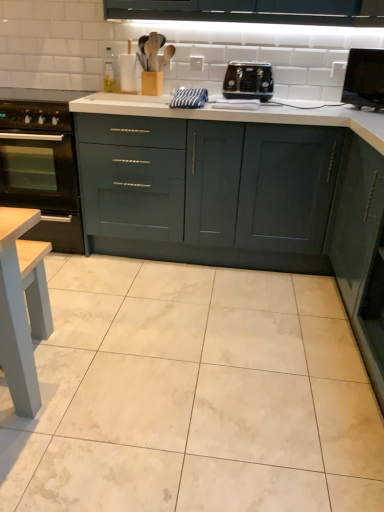
Question: Should I look upward or downward to see teal matte cabinet at center, the 1th cabinetry positioned from the left?

Choices:
 (A) down
 (B) up

Answer: (B)

Question: Considering the relative sizes of white glossy tile at center and black glass oven at lower left in the image provided, is white glossy tile at center shorter than black glass oven at lower left?

Choices:
 (A) yes
 (B) no

Answer: (A)

Question: Does white glossy tile at center have a smaller size compared to black glass oven at lower left?

Choices:
 (A) no
 (B) yes

Answer: (B)

Question: Considering the relative positions of white glossy tile at center and black glass oven at lower left in the image provided, is white glossy tile at center behind black glass oven at lower left?

Choices:
 (A) yes
 (B) no

Answer: (B)

Question: Considering the relative sizes of white glossy tile at center and black glass oven at lower left in the image provided, is white glossy tile at center thinner than black glass oven at lower left?

Choices:
 (A) no
 (B) yes

Answer: (A)

Question: Is white glossy tile at center oriented away from black glass oven at lower left?

Choices:
 (A) yes
 (B) no

Answer: (B)

Question: Could you tell me if white glossy tile at center is turned towards black glass oven at lower left?

Choices:
 (A) yes
 (B) no

Answer: (B)

Question: Considering the relative sizes of matte dark green cabinet at right, the second cabinetry in the left-to-right sequence, and black glossy monitor at upper right in the image provided, is matte dark green cabinet at right, the second cabinetry in the left-to-right sequence, taller than black glossy monitor at upper right?

Choices:
 (A) no
 (B) yes

Answer: (B)

Question: Is black glossy monitor at upper right inside matte dark green cabinet at right, which is counted as the 2th cabinetry, starting from the back?

Choices:
 (A) yes
 (B) no

Answer: (B)

Question: From the image's perspective, would you say matte dark green cabinet at right, placed as the first cabinetry when sorted from right to left, is shown under black glossy monitor at upper right?

Choices:
 (A) no
 (B) yes

Answer: (B)

Question: Is matte dark green cabinet at right, marked as the first cabinetry in a front-to-back arrangement, far away from black glossy monitor at upper right?

Choices:
 (A) no
 (B) yes

Answer: (A)

Question: Does matte dark green cabinet at right, which is counted as the 2th cabinetry, starting from the back, turn towards black glossy monitor at upper right?

Choices:
 (A) yes
 (B) no

Answer: (B)

Question: Can you see matte dark green cabinet at right, which is counted as the 2th cabinetry, starting from the back, touching black glossy monitor at upper right?

Choices:
 (A) no
 (B) yes

Answer: (A)

Question: Is matte dark green cabinet at right, which is counted as the 2th cabinetry, starting from the back, facing away from black matte gas stove at left?

Choices:
 (A) no
 (B) yes

Answer: (A)